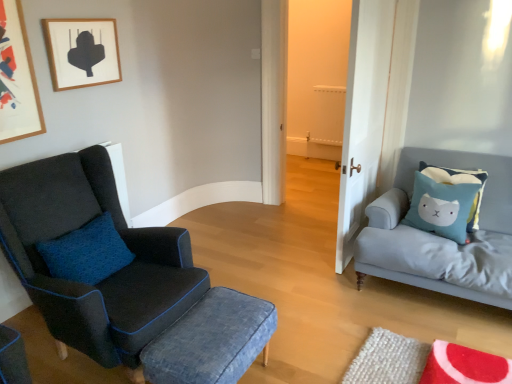
Question: In terms of height, does wooden framed artwork at upper left, which is counted as the 1th picture frame, starting from the left, look taller or shorter compared to light blue fabric cushion at right?

Choices:
 (A) tall
 (B) short

Answer: (A)

Question: Is wooden framed artwork at upper left, which is counted as the 1th picture frame, starting from the left, inside the boundaries of light blue fabric cushion at right, or outside?

Choices:
 (A) inside
 (B) outside

Answer: (B)

Question: Which of these objects is positioned farthest from the wooden picture frame at upper left, the first picture frame when ordered from right to left?

Choices:
 (A) denim fabric stool at center
 (B) light gray fabric studio couch at right
 (C) matte black armchair at left
 (D) white wood door at center
 (E) light blue fabric cushion at right

Answer: (E)

Question: Estimate the real-world distances between objects in this image. Which object is farther from the denim fabric stool at center?

Choices:
 (A) light blue fabric cushion at right
 (B) light gray fabric studio couch at right
 (C) wooden picture frame at upper left, the first picture frame when ordered from right to left
 (D) white wood door at center
 (E) matte black armchair at left

Answer: (C)